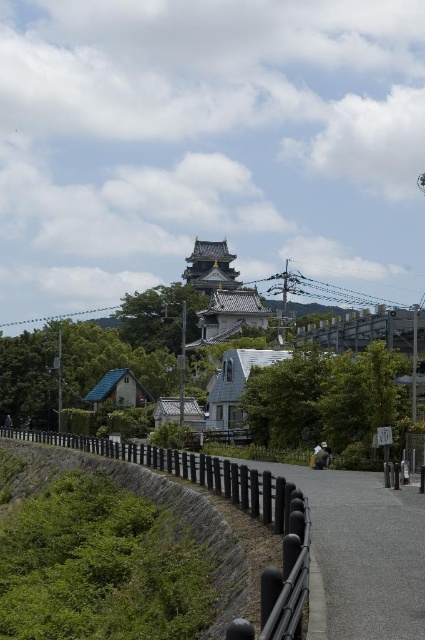
Does black metal railing at lower center have a lesser height compared to stone wall at lower center?

Indeed, black metal railing at lower center has a lesser height compared to stone wall at lower center.

Can you confirm if black metal railing at lower center is positioned below stone wall at lower center?

No, black metal railing at lower center is not below stone wall at lower center.

I want to click on black metal railing at lower center, so click(363, 552).

At what (x,y) coordinates should I click in order to perform the action: click on black metal railing at lower center. Please return your answer as a coordinate pair (x, y). This screenshot has height=640, width=425. Looking at the image, I should click on (363, 552).